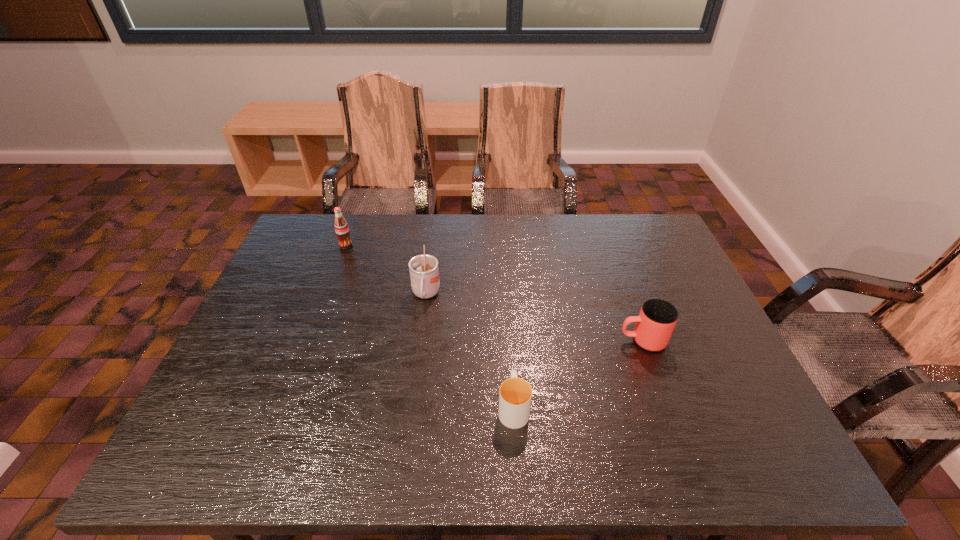
This screenshot has height=540, width=960. In order to click on soda in this screenshot , I will do `click(341, 227)`.

Identify the location of the farthest object. This screenshot has height=540, width=960. (341, 227).

Identify the location of the leftmost cup. The width and height of the screenshot is (960, 540). (424, 274).

Locate an element on the screen. The image size is (960, 540). the third nearest object is located at coordinates (424, 274).

You are a GUI agent. You are given a task and a screenshot of the screen. Output one action in this format:
    pyautogui.click(x=<x>, y=<y>)
    Task: Click on the second farthest cup
    Image resolution: width=960 pixels, height=540 pixels.
    Given the screenshot: What is the action you would take?
    pyautogui.click(x=657, y=318)

Identify the location of the rightmost cup. The image size is (960, 540). (657, 318).

I want to click on the shortest object, so coord(515,394).

What are the coordinates of `the shortest cup` in the screenshot? It's located at (515, 394).

This screenshot has width=960, height=540. I want to click on vacant region located 0.400m on the front of the soda, so click(307, 349).

Identify the location of free space located on the side with the handle of the tallest cup. The width and height of the screenshot is (960, 540). (408, 430).